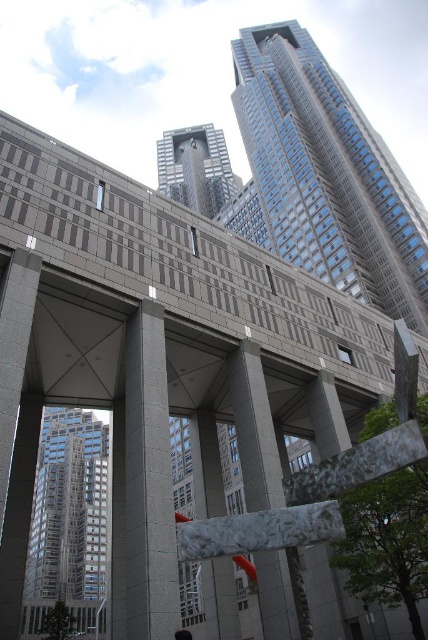
Question: Is silver glass tower at center to the right of sleek glass skyscraper at center from the viewer's perspective?

Choices:
 (A) yes
 (B) no

Answer: (B)

Question: Which point is farther to the camera?

Choices:
 (A) (67, 589)
 (B) (253, 502)
 (C) (169, 195)

Answer: (C)

Question: Can you confirm if gray concrete pillar at center is positioned to the left of sleek glass skyscraper at center?

Choices:
 (A) no
 (B) yes

Answer: (A)

Question: Which point appears farthest from the camera in this image?

Choices:
 (A) (169, 580)
 (B) (240, 376)
 (C) (80, 540)

Answer: (C)

Question: Is glassy steel skyscraper at upper right in front of marble-like stone column at center?

Choices:
 (A) yes
 (B) no

Answer: (B)

Question: Among these points, which one is nearest to the camera?

Choices:
 (A) (33, 502)
 (B) (287, 573)

Answer: (B)